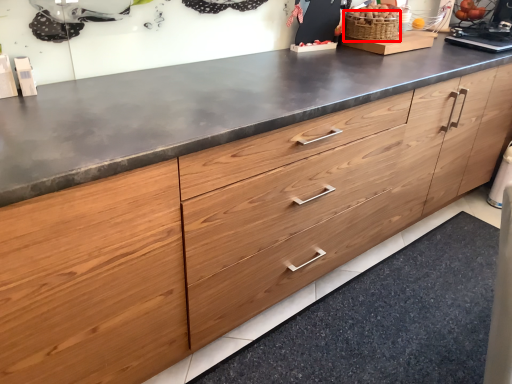
Question: From the image's perspective, what is the correct spatial relationship of basket (annotated by the red box) in relation to granite?

Choices:
 (A) above
 (B) below

Answer: (A)